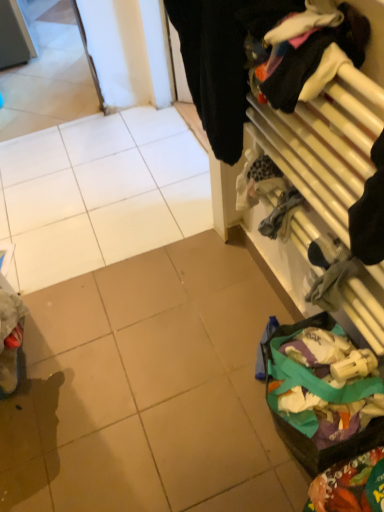
Question: Is multicolored fabric at lower right, which appears as the 2th waste when viewed from the back, wider or thinner than black fabric at upper right?

Choices:
 (A) thin
 (B) wide

Answer: (A)

Question: Considering the relative positions of multicolored fabric at lower right, which appears as the 2th waste when viewed from the back, and black fabric at upper right in the image provided, is multicolored fabric at lower right, which appears as the 2th waste when viewed from the back, to the left or to the right of black fabric at upper right?

Choices:
 (A) left
 (B) right

Answer: (B)

Question: Which object is positioned closest to the black fabric at upper right?

Choices:
 (A) multicolored fabric at lower right, the first waste positioned from the front
 (B) multicolored fabric bag at lower right, the 2th waste from the front
 (C) wooden rack at right

Answer: (C)

Question: Which object is the closest to the black fabric at upper right?

Choices:
 (A) wooden rack at right
 (B) multicolored fabric at lower right, the first waste positioned from the front
 (C) multicolored fabric bag at lower right, the 2th waste from the front

Answer: (A)